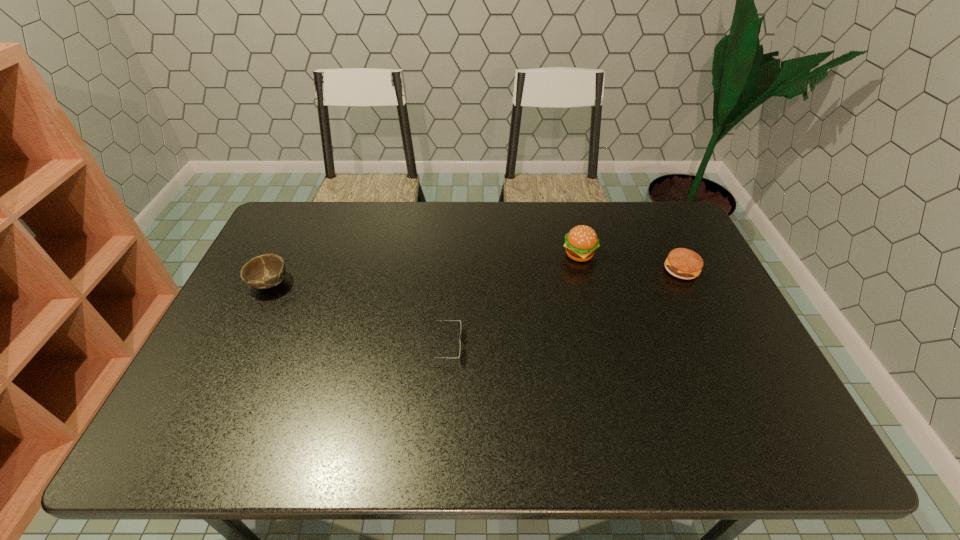
You are a GUI agent. You are given a task and a screenshot of the screen. Output one action in this format:
    pyautogui.click(x=<x>, y=<y>)
    Task: Click on the blank space located on the front-facing side of the third object from right to left
    The image size is (960, 540).
    Given the screenshot: What is the action you would take?
    pyautogui.click(x=564, y=346)

Where is `object that is at the far edge`? This screenshot has width=960, height=540. object that is at the far edge is located at coordinates (581, 242).

The width and height of the screenshot is (960, 540). Find the location of `object located at the left edge`. object located at the left edge is located at coordinates (265, 271).

You are a GUI agent. You are given a task and a screenshot of the screen. Output one action in this format:
    pyautogui.click(x=<x>, y=<y>)
    Task: Click on the object located in the right edge section of the desktop
    The image size is (960, 540).
    Given the screenshot: What is the action you would take?
    pyautogui.click(x=682, y=263)

You are a GUI agent. You are given a task and a screenshot of the screen. Output one action in this format:
    pyautogui.click(x=<x>, y=<y>)
    Task: Click on the blank space at the far edge
    
    Given the screenshot: What is the action you would take?
    pyautogui.click(x=540, y=230)

Where is `free space at the near edge`? The image size is (960, 540). free space at the near edge is located at coordinates (276, 424).

The image size is (960, 540). Identify the location of free spot at the left edge of the desktop. (300, 275).

The image size is (960, 540). I want to click on free region at the right edge, so click(725, 363).

Where is `vacant region at the far right corner`? The height and width of the screenshot is (540, 960). vacant region at the far right corner is located at coordinates (682, 233).

Locate an element on the screen. The width and height of the screenshot is (960, 540). vacant area that lies between the rightmost object and the leftmost object is located at coordinates pos(475,276).